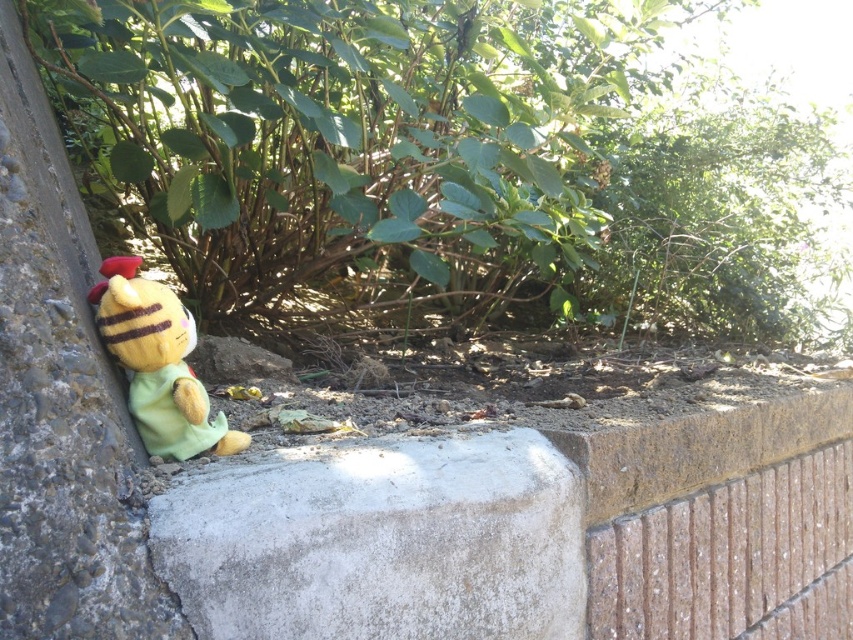
Question: Can you confirm if gray concrete block at center is positioned to the left of yellow plush toy at left?

Choices:
 (A) yes
 (B) no

Answer: (B)

Question: Which of the following is the farthest from the observer?

Choices:
 (A) (119, 348)
 (B) (294, 470)

Answer: (A)

Question: Which of the following is the farthest from the observer?

Choices:
 (A) (149, 353)
 (B) (474, 541)

Answer: (B)

Question: Which of the following is the closest to the observer?

Choices:
 (A) gray concrete block at center
 (B) green leafy bush at center
 (C) yellow plush toy at left

Answer: (A)

Question: Is the position of green leafy bush at center more distant than that of gray concrete block at center?

Choices:
 (A) no
 (B) yes

Answer: (B)

Question: Is green leafy bush at center further to the viewer compared to gray concrete block at center?

Choices:
 (A) yes
 (B) no

Answer: (A)